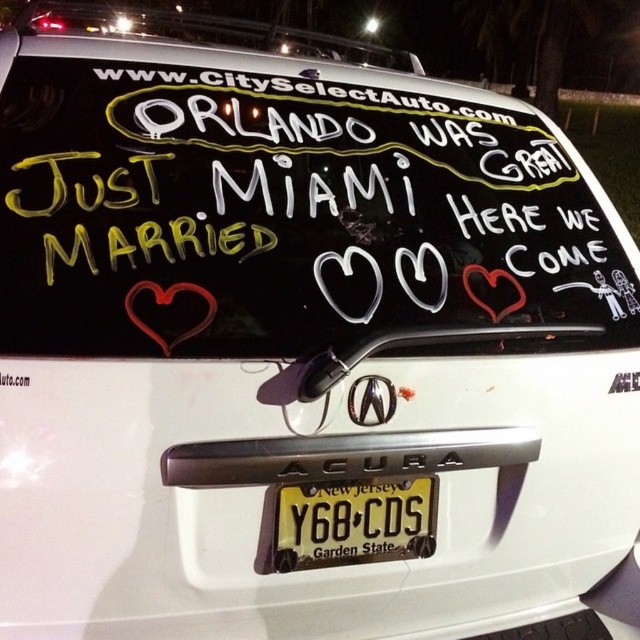
In the scene shown: Who is positioned more to the left, white matte signboard at upper center or matte red heart at center?

Positioned to the left is white matte signboard at upper center.

This screenshot has height=640, width=640. I want to click on white matte signboard at upper center, so click(x=205, y=32).

The height and width of the screenshot is (640, 640). Find the location of `white matte signboard at upper center`. white matte signboard at upper center is located at coordinates (205, 32).

Is black matte signboard at upper center to the left of white matte signboard at upper center from the viewer's perspective?

Incorrect, black matte signboard at upper center is not on the left side of white matte signboard at upper center.

Which is behind, point (28, 353) or point (54, 6)?

The point (54, 6) is more distant.

Does point (90, 352) come in front of point (19, 16)?

Yes, it is in front of point (19, 16).

I want to click on black matte signboard at upper center, so click(284, 211).

Does yellow metallic license plate at center come in front of matte red heart at center?

No, it is not.

The width and height of the screenshot is (640, 640). I want to click on yellow metallic license plate at center, so click(x=353, y=522).

Is point (326, 486) closer to viewer compared to point (188, 289)?

No, (326, 486) is behind (188, 289).

This screenshot has height=640, width=640. Find the location of `yellow metallic license plate at center`. yellow metallic license plate at center is located at coordinates (353, 522).